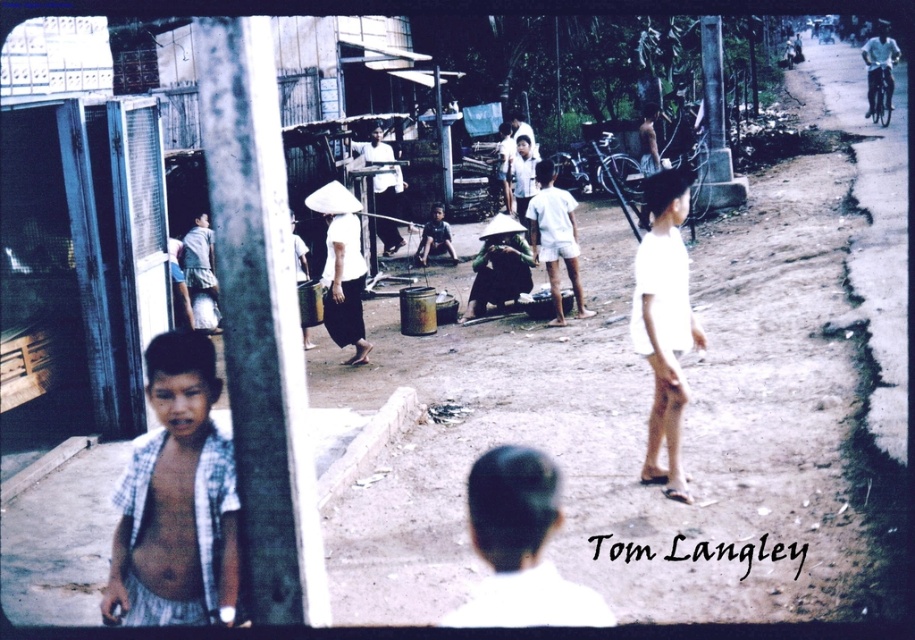
Question: Which point appears closest to the camera in this image?

Choices:
 (A) (498, 256)
 (B) (346, 234)
 (C) (540, 250)
 (D) (178, 560)

Answer: (D)

Question: Does checkered fabric shirt at left appear on the right side of white matte shirt at center?

Choices:
 (A) yes
 (B) no

Answer: (B)

Question: Which point is closer to the camera taking this photo?

Choices:
 (A) (210, 362)
 (B) (535, 173)
 (C) (469, 307)

Answer: (A)

Question: Is white matte shirt at center smaller than white matte shorts at right?

Choices:
 (A) yes
 (B) no

Answer: (B)

Question: Which point is farther to the camera?

Choices:
 (A) checkered fabric shirt at left
 (B) white cotton shirt at center
 (C) white matte shorts at right
 (D) white matte conical hat at center

Answer: (B)

Question: Observing the image, what is the correct spatial positioning of white matte shirt at center in reference to white cotton shirt at center?

Choices:
 (A) left
 (B) right

Answer: (A)